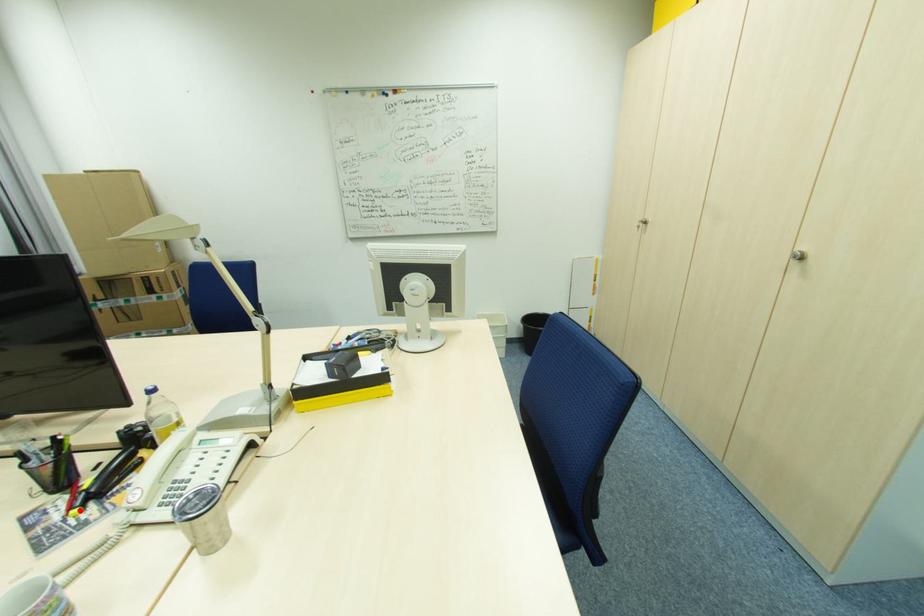
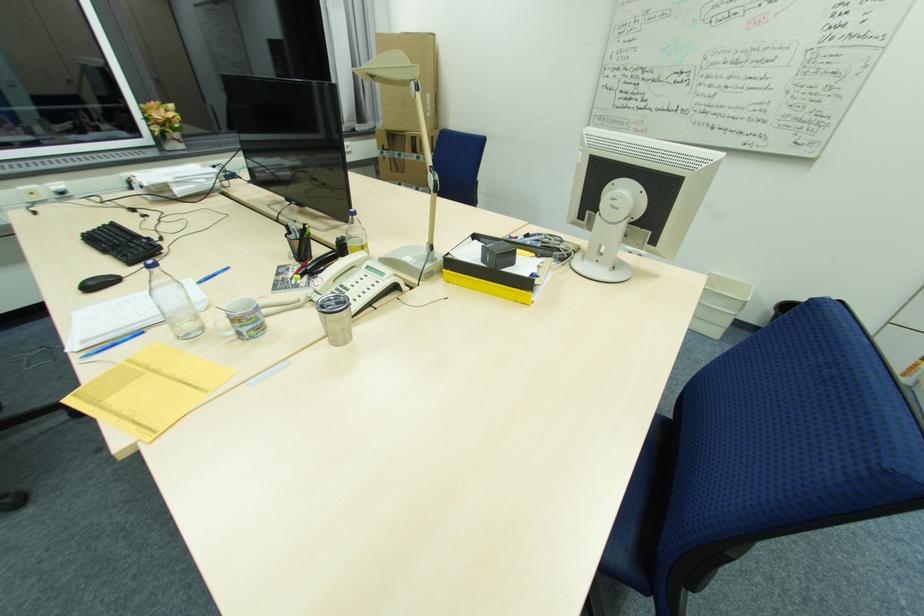
In the second image, find the point that corresponds to the highlighted location in the first image.

(301, 276)